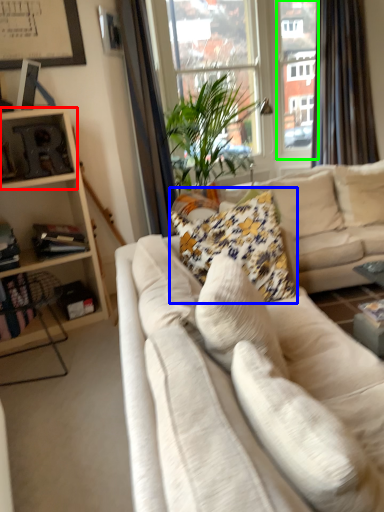
Question: Considering the real-world distances, which object is closest to shelf (highlighted by a red box)? pillow (highlighted by a blue box) or window frame (highlighted by a green box).

Choices:
 (A) pillow
 (B) window frame

Answer: (A)